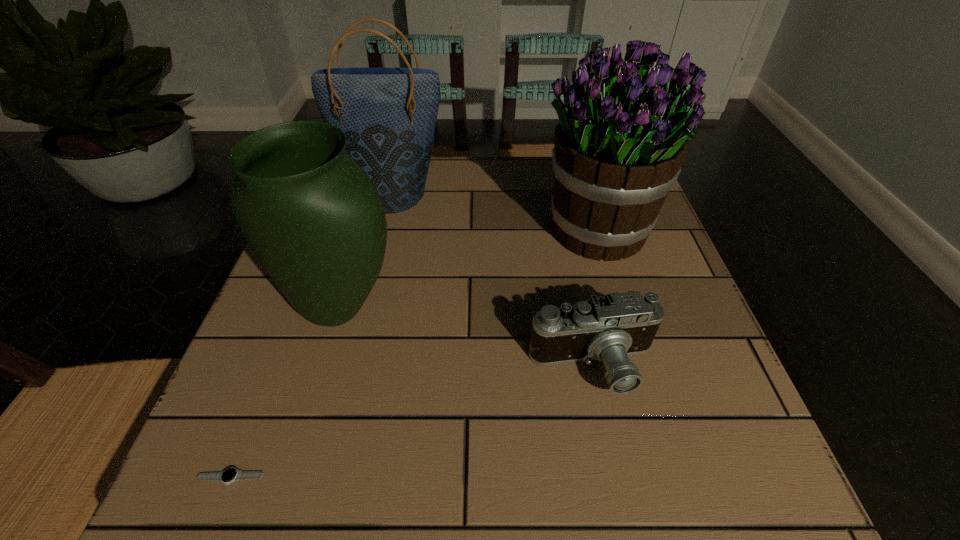
At what (x,y) coordinates should I click in order to perform the action: click on bouquet. Please return your answer as a coordinate pair (x, y). Image resolution: width=960 pixels, height=540 pixels. Looking at the image, I should click on pyautogui.click(x=624, y=128).

At what (x,y) coordinates should I click in order to perform the action: click on shopping bag. Please return your answer as a coordinate pair (x, y). The image size is (960, 540). Looking at the image, I should click on (388, 115).

This screenshot has height=540, width=960. Find the location of `vase`. vase is located at coordinates click(314, 219).

At what (x,y) coordinates should I click in order to perform the action: click on the fourth tallest object. Please return your answer as a coordinate pair (x, y). The height and width of the screenshot is (540, 960). Looking at the image, I should click on (610, 328).

In order to click on watch in this screenshot , I will do `click(229, 475)`.

The width and height of the screenshot is (960, 540). I want to click on the nearest object, so click(x=229, y=475).

Locate an element on the screen. The width and height of the screenshot is (960, 540). vacant space located 0.070m on the back of the bouquet is located at coordinates (583, 181).

This screenshot has width=960, height=540. Identify the location of free point located on the front of the shopping bag. (373, 276).

Locate an element on the screen. vacant region located on the front of the vase is located at coordinates [289, 484].

Image resolution: width=960 pixels, height=540 pixels. In order to click on free space located 0.130m at the lens of the camera in this screenshot , I will do `click(620, 490)`.